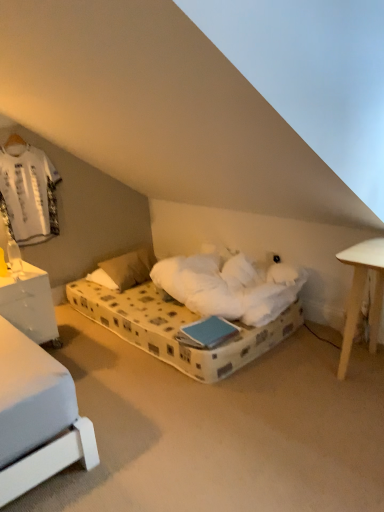
Identify the location of free point in front of white plastic table lamp at left. (13, 275).